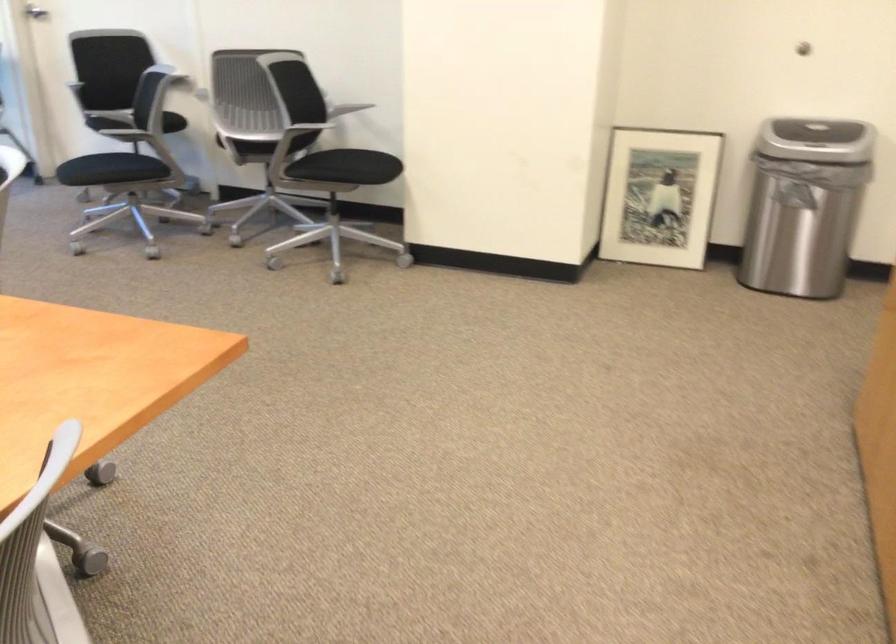
What do you see at coordinates (659, 196) in the screenshot? I see `the framed picture` at bounding box center [659, 196].